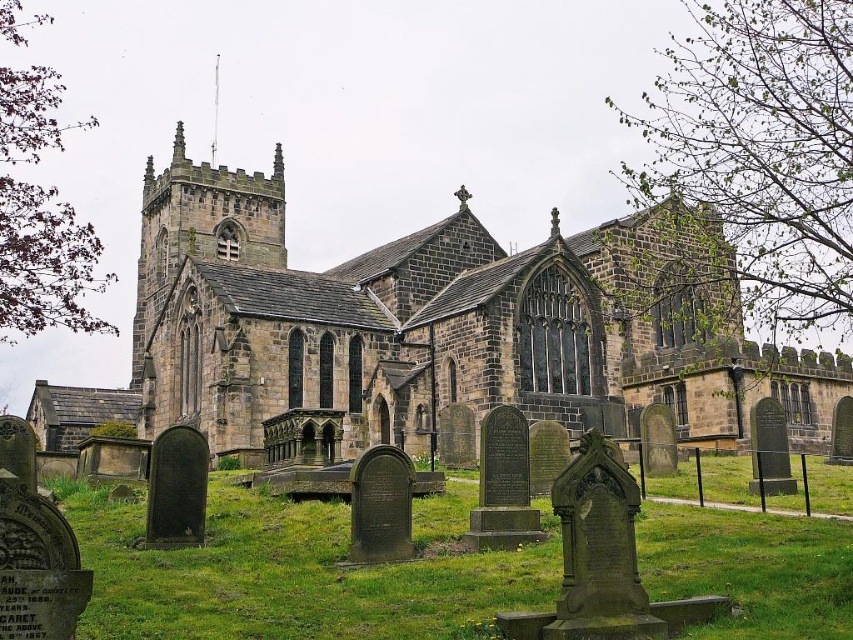
Question: Which point is farther from the camera taking this photo?

Choices:
 (A) (662, 515)
 (B) (390, 422)

Answer: (B)

Question: Among these points, which one is nearest to the camera?

Choices:
 (A) (670, 401)
 (B) (236, 563)

Answer: (B)

Question: From the image, what is the correct spatial relationship of stone church at center in relation to green grass at lower center?

Choices:
 (A) below
 (B) above

Answer: (B)

Question: Does stone church at center appear under green grass at lower center?

Choices:
 (A) yes
 (B) no

Answer: (B)

Question: Is stone church at center bigger than green grass at lower center?

Choices:
 (A) yes
 (B) no

Answer: (A)

Question: Which object is farther from the camera taking this photo?

Choices:
 (A) stone church at center
 (B) green grass at lower center

Answer: (A)